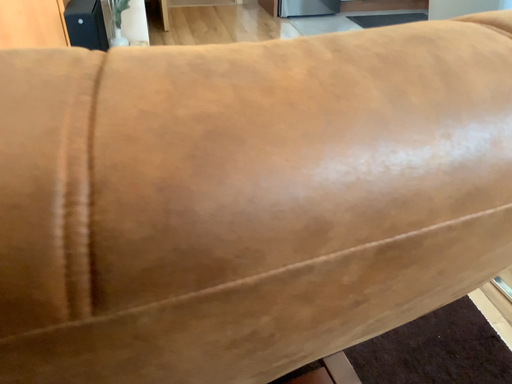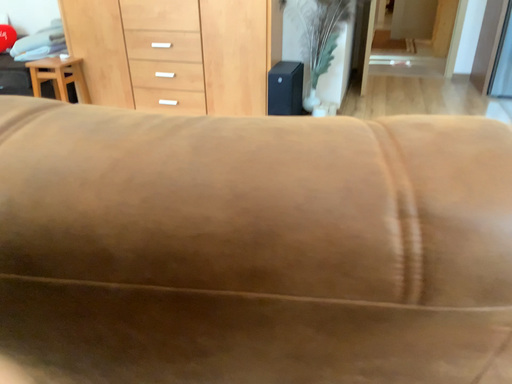
Question: How did the camera likely rotate when shooting the video?

Choices:
 (A) rotated right
 (B) rotated left

Answer: (B)